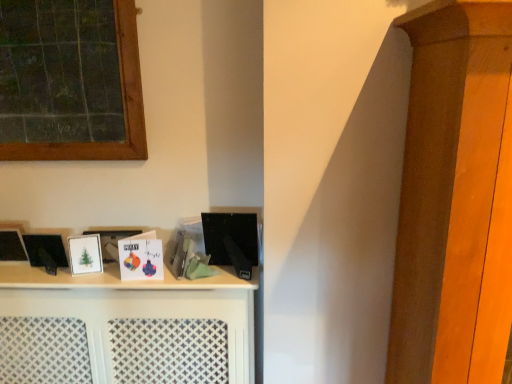
The image size is (512, 384). Identify the location of empty space that is ontop of white matte shelf at center (from a real-world perspective). (88, 276).